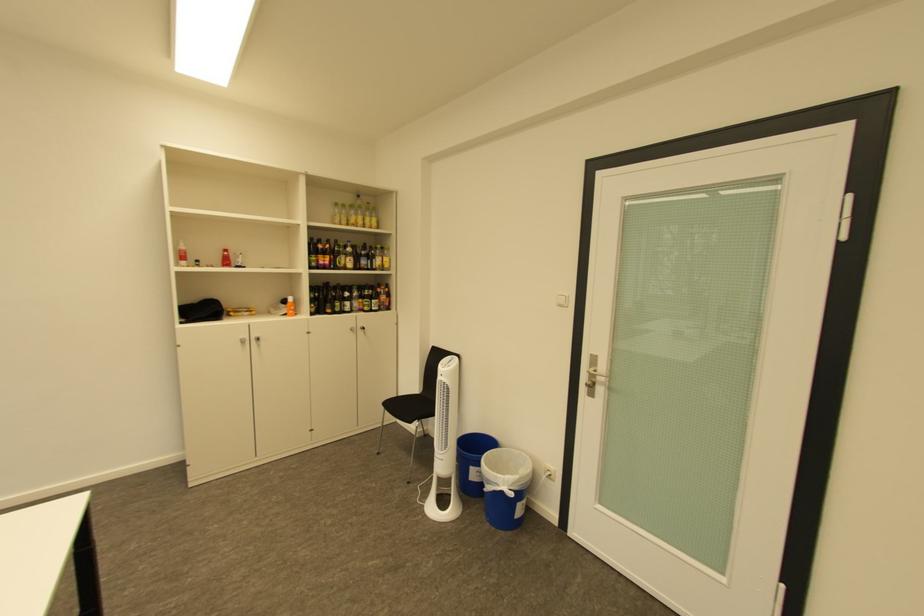
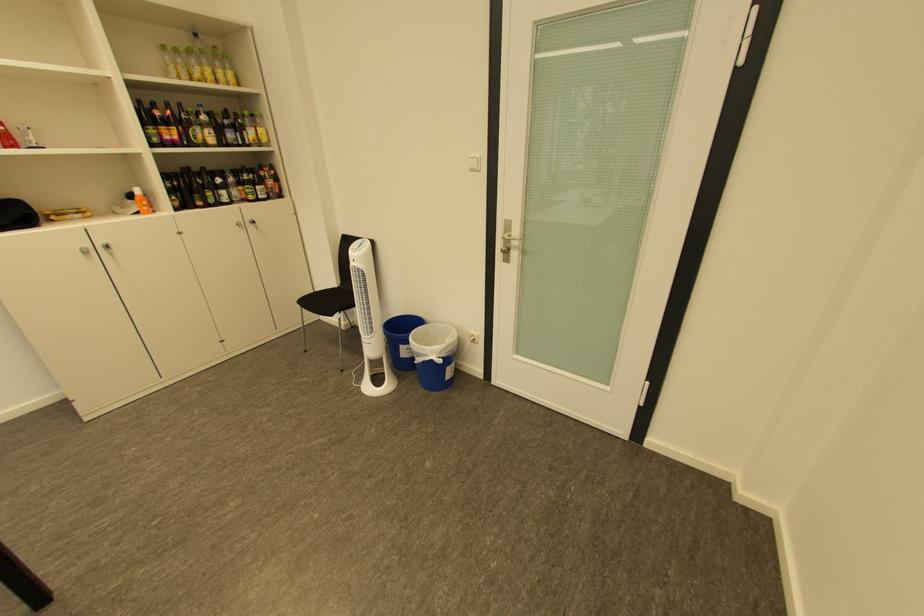
The point at (599, 373) is marked in the first image. Where is the corresponding point in the second image?

(513, 238)